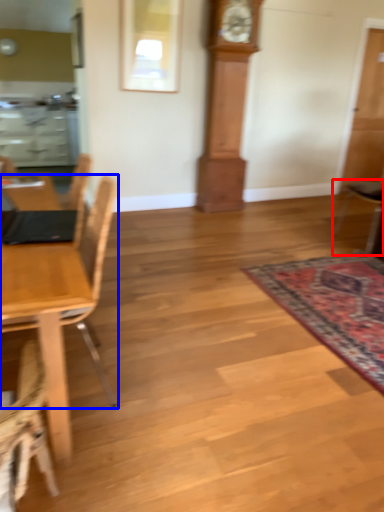
Question: Which object is closer to the camera taking this photo, chair (highlighted by a red box) or chair (highlighted by a blue box)?

Choices:
 (A) chair
 (B) chair

Answer: (B)